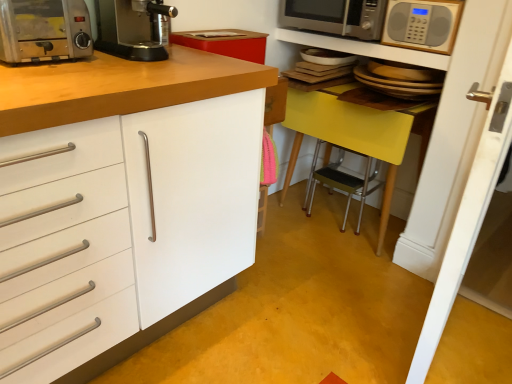
Question: In which direction should I rotate to look at black plastic coffee machine at upper center?

Choices:
 (A) left
 (B) right

Answer: (A)

Question: From the image's perspective, is metallic silver microwave at upper center located above satin silver microwave at upper right, marked as the second microwave oven in a front-to-back arrangement?

Choices:
 (A) yes
 (B) no

Answer: (B)

Question: Is metallic silver microwave at upper center next to satin silver microwave at upper right, marked as the second microwave oven in a front-to-back arrangement?

Choices:
 (A) no
 (B) yes

Answer: (B)

Question: Is metallic silver microwave at upper center positioned far away from satin silver microwave at upper right, which appears as the 1th microwave oven when viewed from the back?

Choices:
 (A) yes
 (B) no

Answer: (B)

Question: Considering the relative sizes of metallic silver microwave at upper center and satin silver microwave at upper right, which appears as the 1th microwave oven when viewed from the back, in the image provided, is metallic silver microwave at upper center bigger than satin silver microwave at upper right, which appears as the 1th microwave oven when viewed from the back,?

Choices:
 (A) no
 (B) yes

Answer: (A)

Question: Is metallic silver microwave at upper center outside satin silver microwave at upper right, which appears as the 1th microwave oven when viewed from the back?

Choices:
 (A) no
 (B) yes

Answer: (B)

Question: Can you confirm if metallic silver microwave at upper center is smaller than satin silver microwave at upper right, which appears as the 1th microwave oven when viewed from the back?

Choices:
 (A) yes
 (B) no

Answer: (A)

Question: Does silver metallic microwave at upper right, positioned as the 2th microwave oven in back-to-front order, touch yellow plastic table at right?

Choices:
 (A) no
 (B) yes

Answer: (A)

Question: Considering the relative positions of silver metallic microwave at upper right, positioned as the 2th microwave oven in back-to-front order, and yellow plastic table at right in the image provided, is silver metallic microwave at upper right, positioned as the 2th microwave oven in back-to-front order, to the left of yellow plastic table at right from the viewer's perspective?

Choices:
 (A) yes
 (B) no

Answer: (B)

Question: Does silver metallic microwave at upper right, positioned as the 2th microwave oven in back-to-front order, have a lesser height compared to yellow plastic table at right?

Choices:
 (A) no
 (B) yes

Answer: (B)

Question: Considering the relative positions of silver metallic microwave at upper right, positioned as the 2th microwave oven in back-to-front order, and yellow plastic table at right in the image provided, is silver metallic microwave at upper right, positioned as the 2th microwave oven in back-to-front order, behind yellow plastic table at right?

Choices:
 (A) yes
 (B) no

Answer: (B)

Question: From a real-world perspective, is silver metallic microwave at upper right, marked as the first microwave oven in a front-to-back arrangement, below yellow plastic table at right?

Choices:
 (A) no
 (B) yes

Answer: (A)

Question: Would you say silver metallic microwave at upper right, marked as the first microwave oven in a front-to-back arrangement, is outside yellow plastic table at right?

Choices:
 (A) yes
 (B) no

Answer: (A)

Question: Is silver metallic microwave at upper right, marked as the first microwave oven in a front-to-back arrangement, taller than black plastic coffee machine at upper center?

Choices:
 (A) yes
 (B) no

Answer: (A)